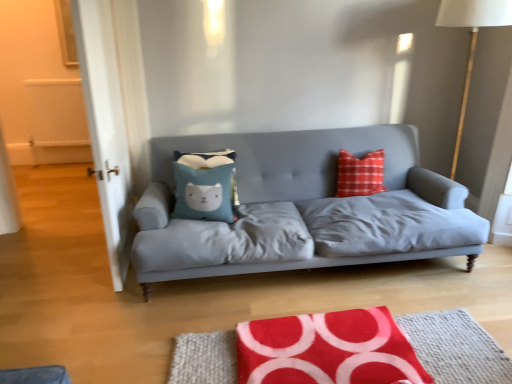
Question: Are blue fabric pillow at center and red fabric rug at lower center far apart?

Choices:
 (A) no
 (B) yes

Answer: (B)

Question: Does blue fabric pillow at center have a smaller size compared to red fabric rug at lower center?

Choices:
 (A) yes
 (B) no

Answer: (B)

Question: Considering the relative sizes of blue fabric pillow at center and red fabric rug at lower center in the image provided, is blue fabric pillow at center shorter than red fabric rug at lower center?

Choices:
 (A) yes
 (B) no

Answer: (B)

Question: Is blue fabric pillow at center to the right of red fabric rug at lower center from the viewer's perspective?

Choices:
 (A) yes
 (B) no

Answer: (B)

Question: Is blue fabric pillow at center positioned before red fabric rug at lower center?

Choices:
 (A) no
 (B) yes

Answer: (A)

Question: Considering their positions, is matte gray fabric couch at center located in front of or behind red fabric rug at lower center?

Choices:
 (A) front
 (B) behind

Answer: (B)

Question: Looking at their shapes, would you say matte gray fabric couch at center is wider or thinner than red fabric rug at lower center?

Choices:
 (A) thin
 (B) wide

Answer: (B)

Question: Visually, is matte gray fabric couch at center positioned to the left or to the right of red fabric rug at lower center?

Choices:
 (A) left
 (B) right

Answer: (A)

Question: Does point (250, 251) appear closer or farther from the camera than point (227, 345)?

Choices:
 (A) farther
 (B) closer

Answer: (A)

Question: In the image, is white fabric lampshade at right on the left side or the right side of blue fabric pillow at center?

Choices:
 (A) right
 (B) left

Answer: (A)

Question: Is white fabric lampshade at right inside or outside of blue fabric pillow at center?

Choices:
 (A) inside
 (B) outside

Answer: (B)

Question: Is point (472, 24) closer or farther from the camera than point (220, 168)?

Choices:
 (A) farther
 (B) closer

Answer: (B)

Question: Considering their positions, is white fabric lampshade at right located in front of or behind blue fabric pillow at center?

Choices:
 (A) behind
 (B) front

Answer: (B)

Question: From the image's perspective, is red fabric rug at lower center positioned above or below white fabric lampshade at right?

Choices:
 (A) below
 (B) above

Answer: (A)

Question: Visually, is red fabric rug at lower center positioned to the left or to the right of white fabric lampshade at right?

Choices:
 (A) left
 (B) right

Answer: (A)